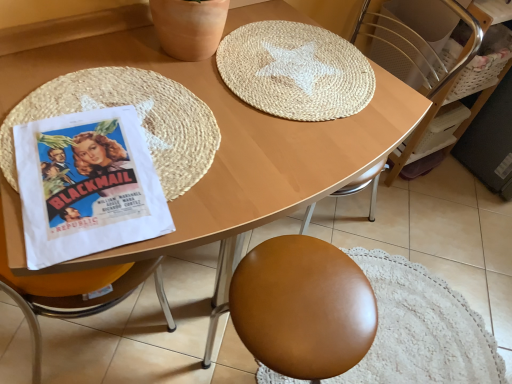
Question: Is woven straw placemat at left, the first mat from the left, with white woven basket at upper right?

Choices:
 (A) no
 (B) yes

Answer: (A)

Question: Does woven straw placemat at left, which ranks as the 2th mat in right-to-left order, have a smaller size compared to white woven basket at upper right?

Choices:
 (A) yes
 (B) no

Answer: (A)

Question: Is woven straw placemat at left, which ranks as the 2th mat in right-to-left order, not near white woven basket at upper right?

Choices:
 (A) yes
 (B) no

Answer: (A)

Question: Is woven straw placemat at left, the first mat from the left, shorter than white woven basket at upper right?

Choices:
 (A) no
 (B) yes

Answer: (B)

Question: From the image's perspective, does woven straw placemat at left, the first mat from the left, appear lower than white woven basket at upper right?

Choices:
 (A) yes
 (B) no

Answer: (A)

Question: In terms of height, does woven straw placemat at left, which ranks as the 2th mat in right-to-left order, look taller or shorter compared to white paper poster at left?

Choices:
 (A) short
 (B) tall

Answer: (B)

Question: Does point (162, 100) appear closer or farther from the camera than point (28, 256)?

Choices:
 (A) closer
 (B) farther

Answer: (B)

Question: From a real-world perspective, is woven straw placemat at left, the first mat from the left, above or below white paper poster at left?

Choices:
 (A) below
 (B) above

Answer: (B)

Question: Is woven straw placemat at left, which ranks as the 2th mat in right-to-left order, to the left or to the right of white paper poster at left in the image?

Choices:
 (A) right
 (B) left

Answer: (A)

Question: Is natural fiber mat at upper center, arranged as the first mat when viewed from the right, bigger or smaller than white paper poster at left?

Choices:
 (A) small
 (B) big

Answer: (B)

Question: Would you say natural fiber mat at upper center, arranged as the first mat when viewed from the right, is to the left or to the right of white paper poster at left in the picture?

Choices:
 (A) right
 (B) left

Answer: (A)

Question: From the image's perspective, is natural fiber mat at upper center, arranged as the first mat when viewed from the right, positioned above or below white paper poster at left?

Choices:
 (A) below
 (B) above

Answer: (B)

Question: From a real-world perspective, is natural fiber mat at upper center, the second mat positioned from the left, positioned above or below white paper poster at left?

Choices:
 (A) below
 (B) above

Answer: (A)

Question: Is white paper poster at left to the left or to the right of natural fiber mat at upper center, arranged as the first mat when viewed from the right, in the image?

Choices:
 (A) left
 (B) right

Answer: (A)

Question: Is point (112, 192) closer or farther from the camera than point (330, 74)?

Choices:
 (A) closer
 (B) farther

Answer: (A)